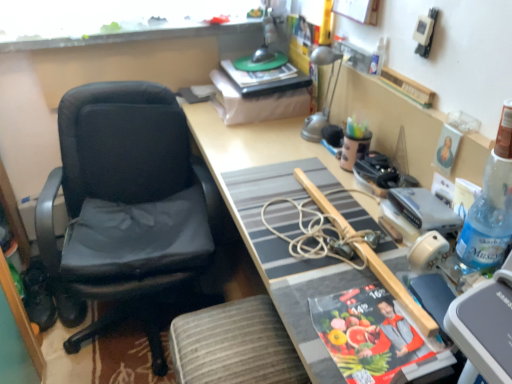
At what (x,y) coordinates should I click in order to perform the action: click on empty space that is ontop of matte paper magazine at lower right (from a real-world perspective). Please return your answer as a coordinate pair (x, y). This screenshot has width=512, height=384. Looking at the image, I should click on (382, 324).